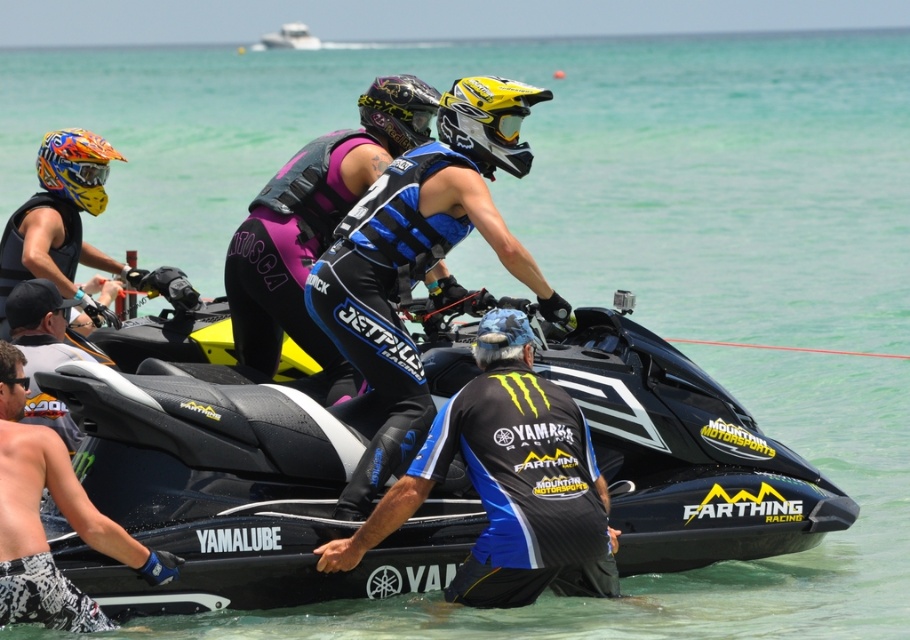
Looking at this image, you are standing at the starting line of a jet ski race and see two points marked on the course map. The first point is at point (282, 45) and the second point is at point (87, 173). Which point should you reach first according to the race route?

You should reach point (87, 173) first because point (282, 45) is behind it in the race route.

You are standing at the camera position and want to reach the point marked at coordinates (299, 29). If your walking speed is 3 feet per second, how many seconds will it take you to reach that point?

The point at coordinates (299, 29) is 400.46 feet away from the camera. At a walking speed of 3 feet per second, it would take approximately 133.49 seconds to reach that point.